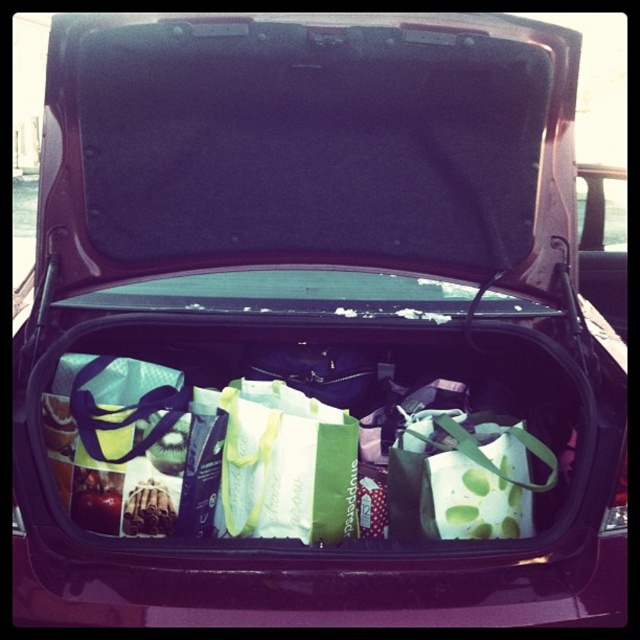
Between green paper gift bag at center and green dotted paper bag at center, which one is positioned higher?

green paper gift bag at center is above.

Between point (276, 522) and point (518, 445), which one is positioned in front?

Point (276, 522) is in front.

This screenshot has width=640, height=640. In order to click on green paper gift bag at center in this screenshot , I will do `click(285, 465)`.